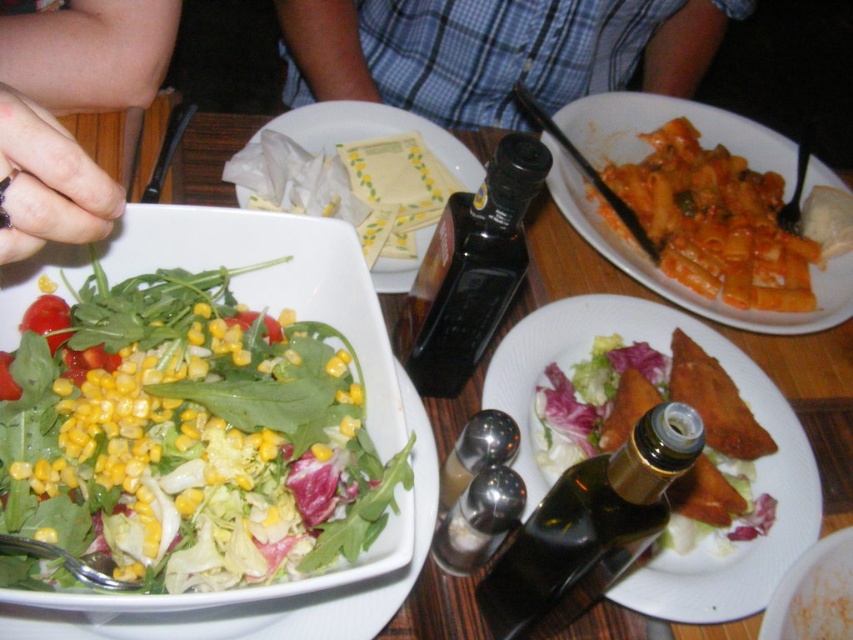
Which is more to the right, tomato-based pasta at center or yellow paper napkins at center?

From the viewer's perspective, tomato-based pasta at center appears more on the right side.

Is tomato-based pasta at center below yellow paper napkins at center?

Correct, tomato-based pasta at center is located below yellow paper napkins at center.

Between point (573, 116) and point (314, 122), which one is positioned behind?

The point (573, 116) is more distant.

Locate an element on the screen. tomato-based pasta at center is located at coordinates (683, 285).

Which is more to the left, tomato-based pasta at center or black glass bottle at center?

From the viewer's perspective, black glass bottle at center appears more on the left side.

Is tomato-based pasta at center further to camera compared to black glass bottle at center?

Yes, tomato-based pasta at center is behind black glass bottle at center.

Is point (778, 150) closer to viewer compared to point (407, 340)?

No, it is not.

At what (x,y) coordinates should I click in order to perform the action: click on tomato-based pasta at center. Please return your answer as a coordinate pair (x, y). Looking at the image, I should click on (683, 285).

Based on the photo, between dark brown glass bottle at center and black glass bottle at center, which one appears on the right side from the viewer's perspective?

dark brown glass bottle at center

Measure the distance between dark brown glass bottle at center and camera.

13.38 inches

Where is `dark brown glass bottle at center`? Image resolution: width=853 pixels, height=640 pixels. dark brown glass bottle at center is located at coordinates (589, 528).